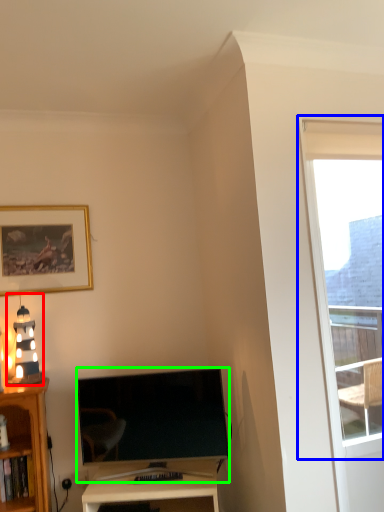
Question: Considering the real-world distances, which object is farthest from light fixture (highlighted by a red box)? window (highlighted by a blue box) or television (highlighted by a green box)?

Choices:
 (A) window
 (B) television

Answer: (A)